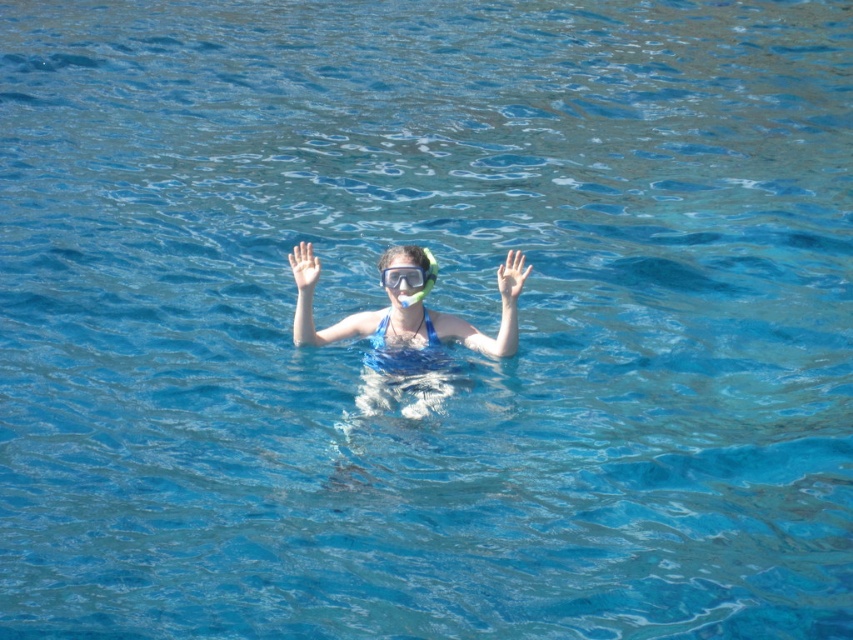
Question: Does transparent rubber hand at center appear under clear plastic goggles at center?

Choices:
 (A) yes
 (B) no

Answer: (B)

Question: Which point appears farthest from the camera in this image?

Choices:
 (A) (381, 282)
 (B) (503, 285)

Answer: (A)

Question: Which point is closer to the camera?

Choices:
 (A) (378, 326)
 (B) (518, 272)

Answer: (B)

Question: Does matte blue swimsuit at center appear on the left side of transparent rubber hand at center?

Choices:
 (A) yes
 (B) no

Answer: (A)

Question: Where is transparent rubber hand at center located in relation to clear plastic goggles at center in the image?

Choices:
 (A) left
 (B) right

Answer: (B)

Question: Estimate the real-world distances between objects in this image. Which object is farther from the transparent rubber hand at center?

Choices:
 (A) clear plastic goggles at center
 (B) matte blue swimsuit at center

Answer: (B)